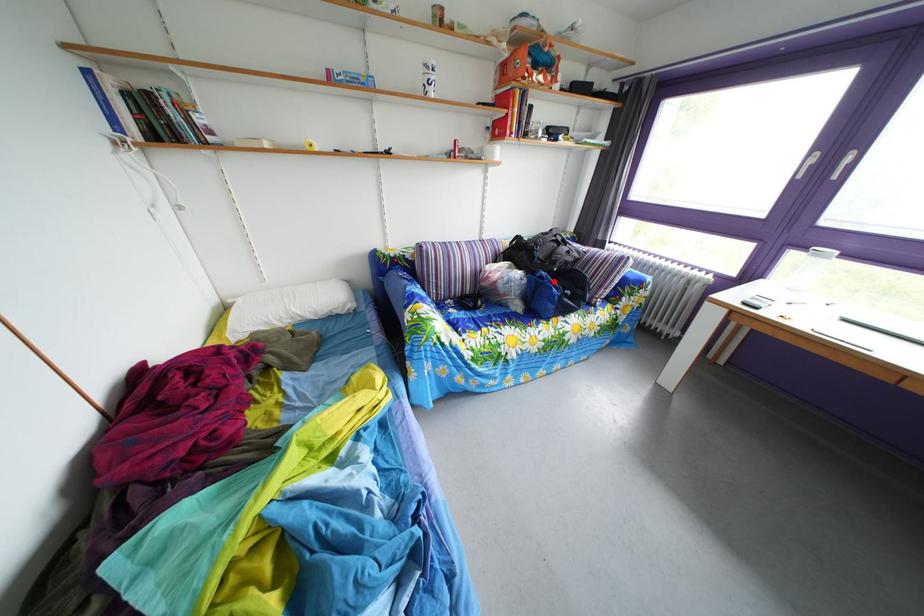
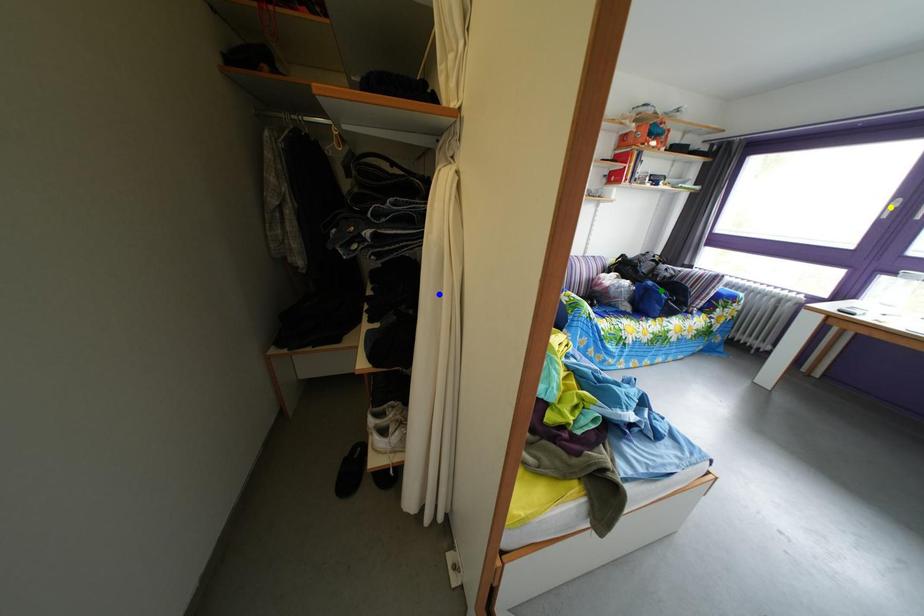
Question: I am providing you with two images of the same scene from different viewpoints. A red point is marked on the first image. You are given multiple points on the second image. Which mark in image 2 goes with the point in image 1?

Choices:
 (A) green point
 (B) yellow point
 (C) blue point

Answer: (A)